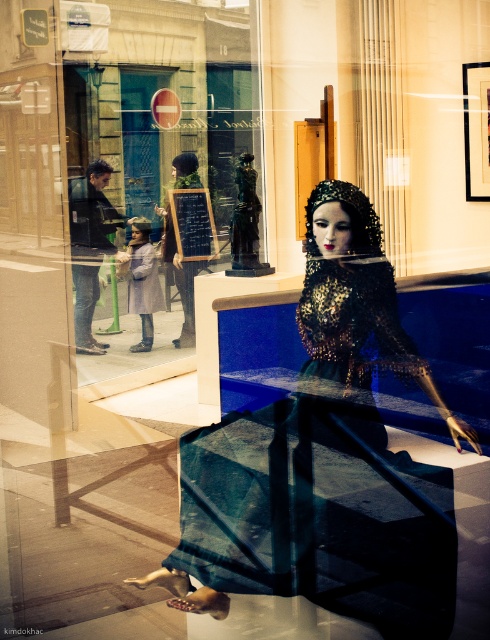
Who is positioned more to the left, shiny sequined dress at center or matte black dress at center?

matte black dress at center is more to the left.

Is point (426, 612) closer to viewer compared to point (154, 342)?

Yes, it is in front of point (154, 342).

At what (x,y) coordinates should I click in order to perform the action: click on shiny sequined dress at center. Please return your answer as a coordinate pair (x, y). Looking at the image, I should click on (324, 461).